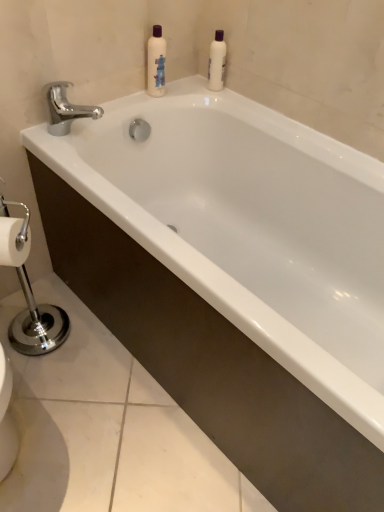
Question: In terms of width, does chrome/metallic faucet at upper left look wider or thinner when compared to white glossy bottle at upper center, marked as the second cleaning product in a right-to-left arrangement?

Choices:
 (A) thin
 (B) wide

Answer: (B)

Question: Do you think chrome/metallic faucet at upper left is within white glossy bottle at upper center, marked as the second cleaning product in a right-to-left arrangement, or outside of it?

Choices:
 (A) inside
 (B) outside

Answer: (B)

Question: Based on their relative distances, which object is nearer to the white glossy bottle at upper center, marked as the first cleaning product in a left-to-right arrangement?

Choices:
 (A) white plastic bottle at upper center, the second cleaning product when ordered from left to right
 (B) chrome/metallic faucet at upper left

Answer: (A)

Question: Which object is the closest to the chrome/metallic faucet at upper left?

Choices:
 (A) white plastic bottle at upper center, the 1th cleaning product positioned from the right
 (B) white glossy bottle at upper center, marked as the second cleaning product in a right-to-left arrangement

Answer: (B)